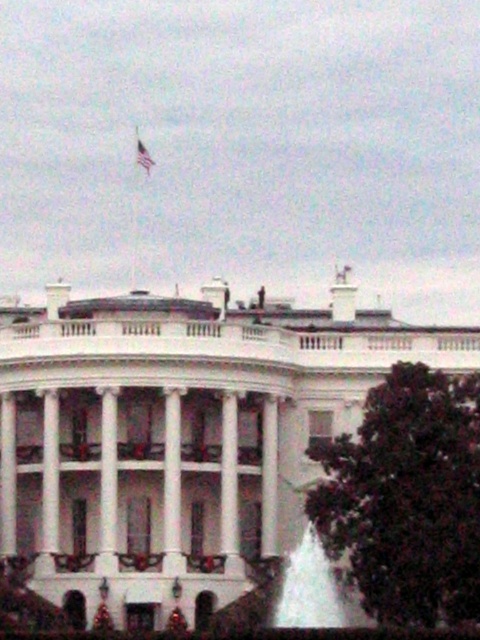
Who is taller, white glossy fountain at lower center or silky fabric flag at upper center?

white glossy fountain at lower center

Does white glossy fountain at lower center appear under silky fabric flag at upper center?

Indeed, white glossy fountain at lower center is positioned under silky fabric flag at upper center.

Which is in front, point (361, 620) or point (143, 150)?

Point (361, 620)

At what (x,y) coordinates should I click in order to perform the action: click on white glossy fountain at lower center. Please return your answer as a coordinate pair (x, y). The width and height of the screenshot is (480, 640). Looking at the image, I should click on (314, 589).